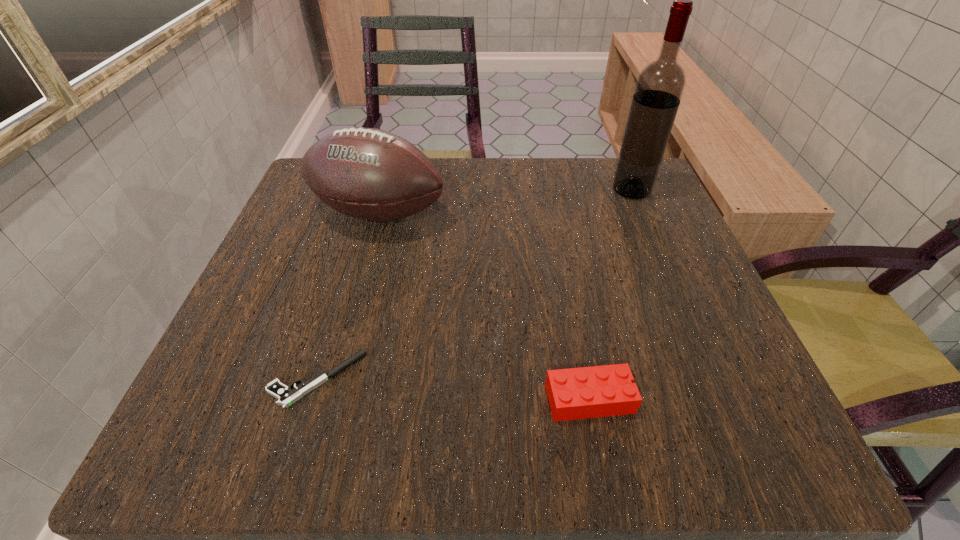
Find the location of a particular element. The height and width of the screenshot is (540, 960). the tallest object is located at coordinates (660, 85).

At what (x,y) coordinates should I click in order to perform the action: click on wine bottle. Please return your answer as a coordinate pair (x, y). This screenshot has height=540, width=960. Looking at the image, I should click on (660, 85).

Identify the location of football (American). The height and width of the screenshot is (540, 960). (370, 174).

Where is `the third object from left to right`? The width and height of the screenshot is (960, 540). the third object from left to right is located at coordinates (599, 391).

Identify the location of the second shortest object. The image size is (960, 540). (599, 391).

Locate an element on the screen. the shortest object is located at coordinates (287, 396).

You are a GUI agent. You are given a task and a screenshot of the screen. Output one action in this format:
    pyautogui.click(x=<x>, y=<y>)
    Task: Click on the vacant space situated 0.350m on the left of the rightmost object
    
    Given the screenshot: What is the action you would take?
    pyautogui.click(x=449, y=190)

This screenshot has height=540, width=960. I want to click on vacant space situated on the back of the football (American), so pyautogui.click(x=393, y=161).

This screenshot has height=540, width=960. Find the location of `vacant position located 0.370m on the back of the Lego`. vacant position located 0.370m on the back of the Lego is located at coordinates (554, 217).

Image resolution: width=960 pixels, height=540 pixels. What are the coordinates of `wine bottle that is at the far edge` in the screenshot? It's located at (660, 85).